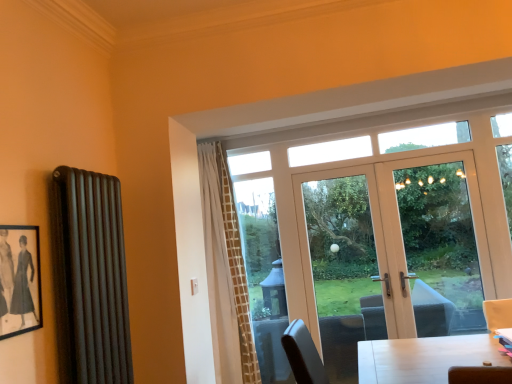
Question: Is black matte picture frame at left bigger or smaller than transparent glass door at center, the second window screen positioned from the back?

Choices:
 (A) big
 (B) small

Answer: (B)

Question: Considering the positions of black matte picture frame at left and transparent glass door at center, which is the second window screen from left to right, in the image, is black matte picture frame at left wider or thinner than transparent glass door at center, which is the second window screen from left to right,?

Choices:
 (A) wide
 (B) thin

Answer: (B)

Question: Based on their relative distances, which object is nearer to the clear glass window at center, which is the first window screen from back to front?

Choices:
 (A) matte black radiator at left
 (B) transparent glass door at center, the 1th window screen viewed from the front
 (C) black matte picture frame at left
 (D) clear glass door at center
 (E) white textured curtain at center

Answer: (E)

Question: Considering the real-world distances, which object is closest to the white glossy door at center?

Choices:
 (A) black matte picture frame at left
 (B) clear glass door at center
 (C) clear glass window at center, placed as the first window screen when sorted from left to right
 (D) transparent glass door at center, which is the second window screen from left to right
 (E) white textured curtain at center

Answer: (D)